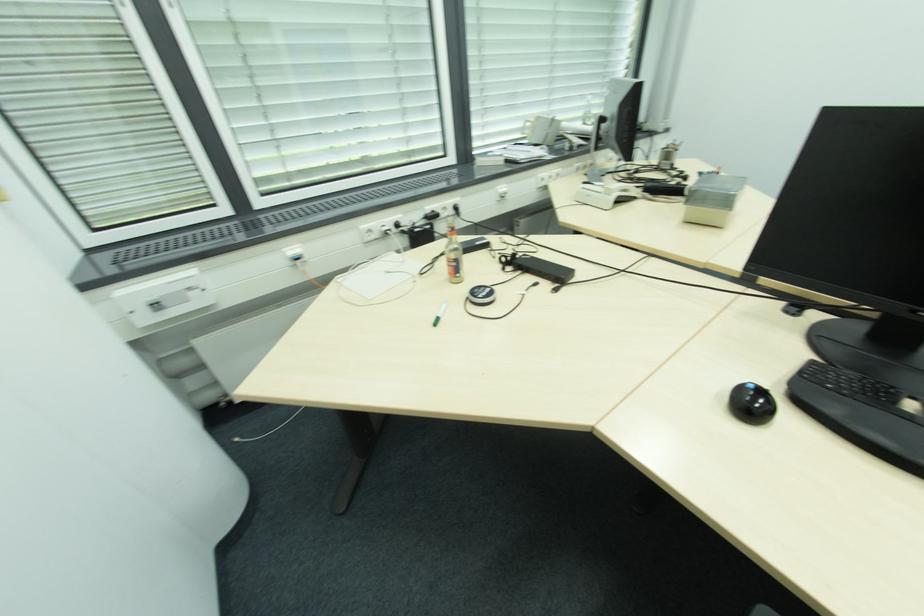
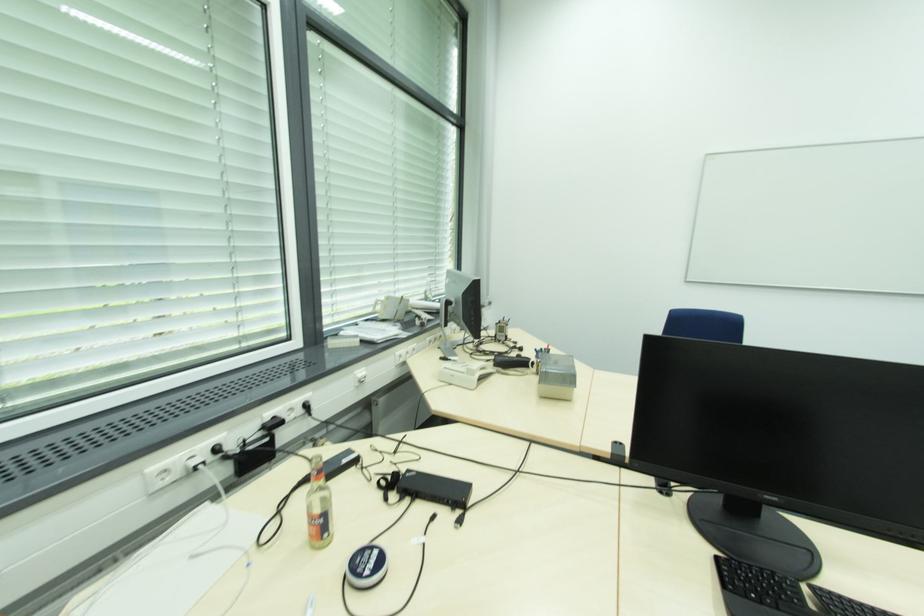
Locate, in the second image, the point that corresponds to (x=492, y=290) in the first image.

(379, 552)